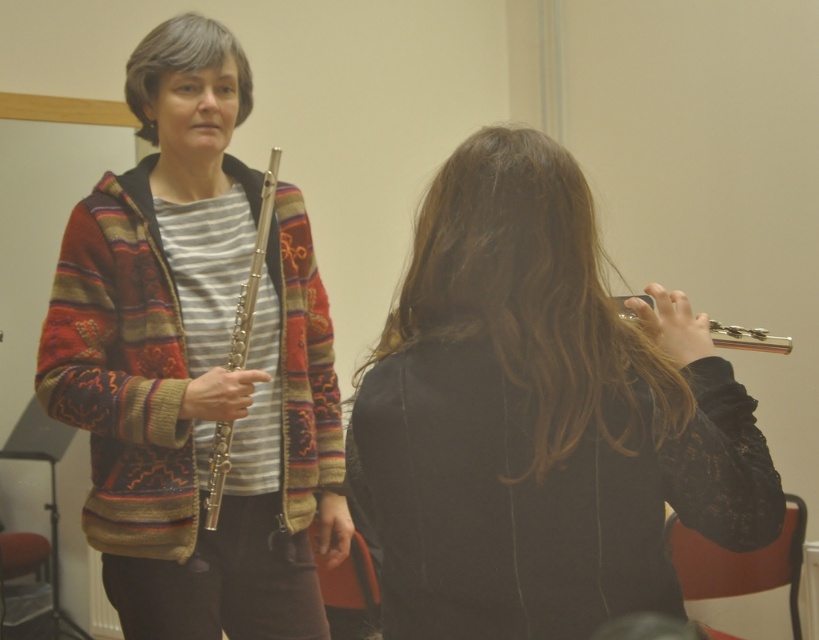
You are standing in the classroom and want to determine which of the two points, point (x=534, y=364) or point (x=736, y=333), is closer to you. Based on the image, which one is nearer?

Point (x=534, y=364) is closer to the viewer than point (x=736, y=333), so it is the nearer one.

You are a student in the classroom and need to locate the black fabric jacket at center. According to the coordinates provided, where would you find it?

The black fabric jacket at center is located at point (x=541, y=417).

You are a student in the classroom and want to hand your flute to the instructor. The instructor is holding the silver metallic flute at left. Your flute is the silver metallic flute at right. Can you directly hand your flute to the instructor without moving it forward?

The silver metallic flute at right is behind silver metallic flute at left. Since your flute is behind the instructor, you cannot directly hand it to them without moving it forward.